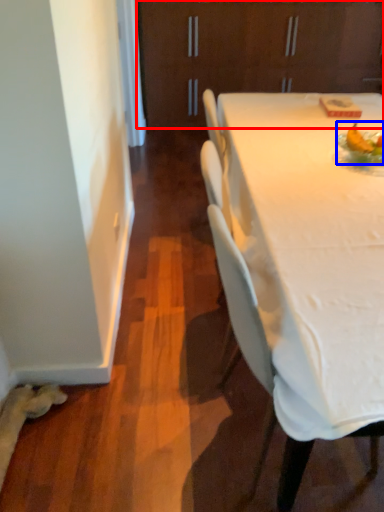
Question: Among these objects, which one is nearest to the camera, cabinetry (highlighted by a red box) or food (highlighted by a blue box)?

Choices:
 (A) cabinetry
 (B) food

Answer: (B)